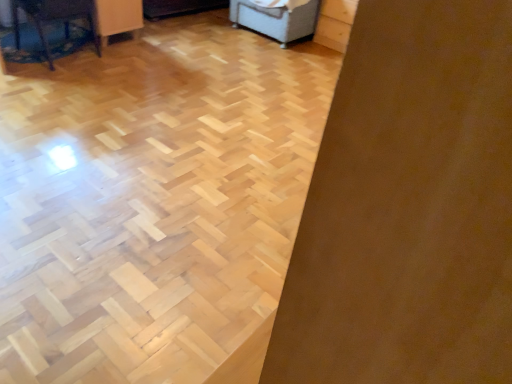
Where is `free spot in front of light gray fabric ottoman at upper center, which is the 2th furniture from left to right`? free spot in front of light gray fabric ottoman at upper center, which is the 2th furniture from left to right is located at coordinates (263, 53).